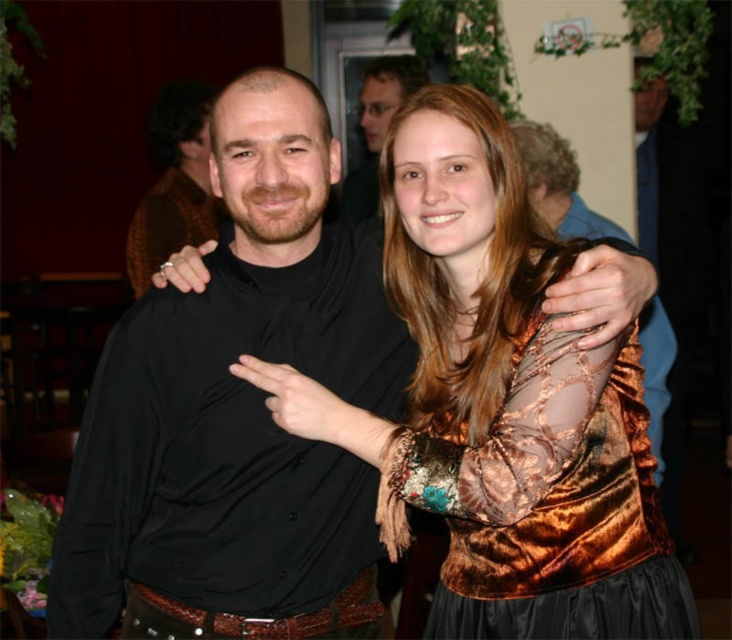
You are at a party and want to take a photo of the velvet gold dress at center and the velvet gold dress at upper right. Which one is positioned to the left side of the other?

The velvet gold dress at center is to the left of the velvet gold dress at upper right.

You are a photographer at the event and need to adjust the lighting to ensure both the black satin shirt at center and the matte black shirt at upper center are well lit. Considering their positions, which shirt should you focus on first to account for their size differences?

The black satin shirt at center has a greater height compared to the matte black shirt at upper center, so you should focus on the black satin shirt at center first since it is larger and may require more light to ensure proper exposure.

You are a photographer standing at the center of the room. You want to take a closeup shot of the velvet gold dress at upper right without moving the subject. Can you adjust your camera lens to focus on the dress from your current position?

The velvet gold dress at upper right is 1.20 meters away from the viewer. Since the photographer is at the center of the room and the dress is within a typical focusing range of most cameras, adjusting the lens should allow focusing on the dress without moving the subject.